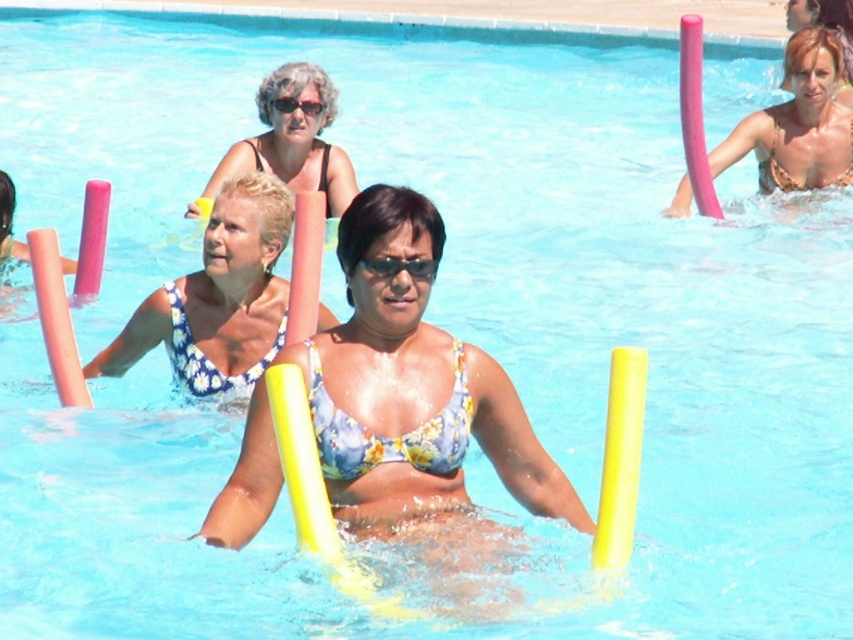
Question: Is pink foam float at left wider than black plastic goggles at center?

Choices:
 (A) yes
 (B) no

Answer: (B)

Question: Observing the image, what is the correct spatial positioning of pink foam float at upper right in reference to black plastic goggles at upper center?

Choices:
 (A) right
 (B) left

Answer: (A)

Question: Which point is closer to the camera?

Choices:
 (A) (718, 145)
 (B) (334, 116)
 (C) (22, 248)
 (D) (316, 113)

Answer: (C)

Question: Which of the following is the farthest from the observer?

Choices:
 (A) pink foam float at left
 (B) black plastic goggles at upper center

Answer: (B)

Question: Among these points, which one is nearest to the camera?

Choices:
 (A) (801, 173)
 (B) (393, 266)
 (C) (279, 99)
 (D) (126, 369)

Answer: (B)

Question: Is matte black bikini top at upper center thinner than black plastic goggles at center?

Choices:
 (A) no
 (B) yes

Answer: (A)